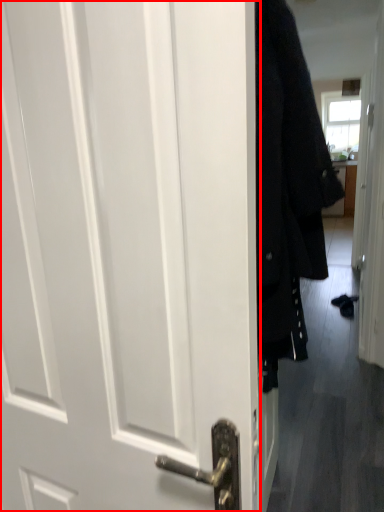
Question: From the image's perspective, where is door (annotated by the red box) located relative to coat?

Choices:
 (A) below
 (B) above

Answer: (A)